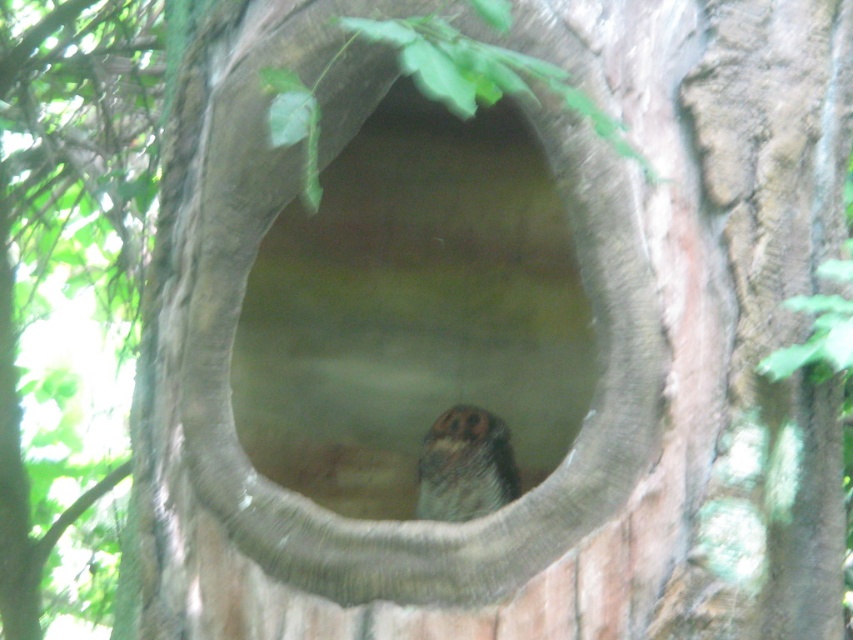
Looking at this image, you are a bird looking for a nesting spot. You see a smooth concrete hole at center and a brown speckled owl at center. Which object is on the left side?

The smooth concrete hole at center is positioned on the left side of the brown speckled owl at center.